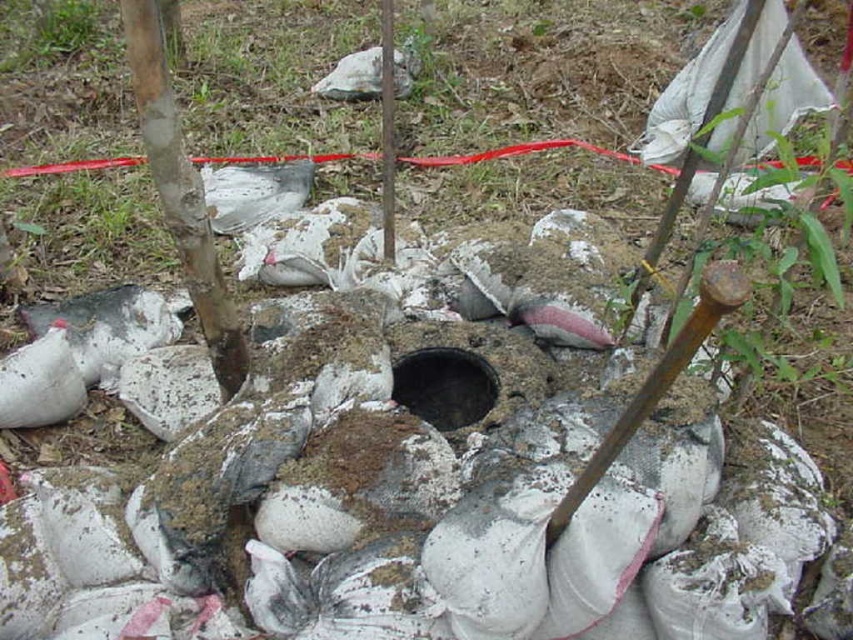
Question: Is brown wooden shovel at center smaller than brushed metal pole at center?

Choices:
 (A) no
 (B) yes

Answer: (A)

Question: Does brown wooden shovel at center appear under black concrete hole at center?

Choices:
 (A) yes
 (B) no

Answer: (B)

Question: Which object appears closest to the camera in this image?

Choices:
 (A) black concrete hole at center
 (B) brown wooden shovel at center
 (C) smooth bark pole at center

Answer: (B)

Question: Considering the real-world distances, which object is closest to the brown wooden shovel at center?

Choices:
 (A) black concrete hole at center
 (B) smooth bark pole at center

Answer: (A)

Question: Is brown wooden shovel at center below black concrete hole at center?

Choices:
 (A) yes
 (B) no

Answer: (B)

Question: Which point is closer to the camera?

Choices:
 (A) (207, 292)
 (B) (662, 388)
 (C) (387, 209)
 (D) (445, 422)

Answer: (B)